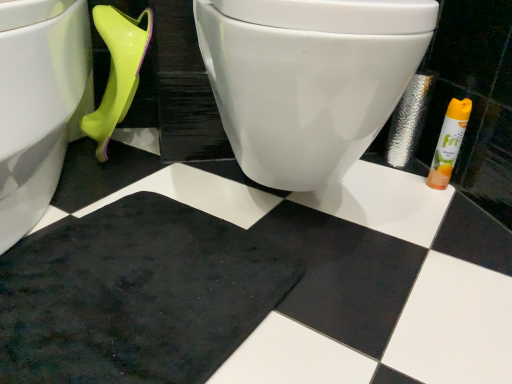
Describe the element at coordinates (308, 79) in the screenshot. I see `white glossy toilet at center, which is counted as the 1th toilet, starting from the right` at that location.

This screenshot has width=512, height=384. What are the coordinates of `white glossy toilet at lower left, which is the 1th toilet in left-to-right order` in the screenshot? It's located at 39,103.

What do you see at coordinates (39, 103) in the screenshot?
I see `white glossy toilet at lower left, the second toilet in the right-to-left sequence` at bounding box center [39, 103].

Locate an element on the screen. white glossy toilet at center, which is counted as the 1th toilet, starting from the right is located at coordinates (308, 79).

How different are the orientations of black rubber bath mat at lower left and white glossy toilet at center, which is counted as the 1th toilet, starting from the right, in degrees?

The facing directions of black rubber bath mat at lower left and white glossy toilet at center, which is counted as the 1th toilet, starting from the right, are 43.9 degrees apart.

Is black rubber bath mat at lower left smaller than white glossy toilet at center, which is counted as the 1th toilet, starting from the right?

Yes, black rubber bath mat at lower left is smaller than white glossy toilet at center, which is counted as the 1th toilet, starting from the right.

Are black rubber bath mat at lower left and white glossy toilet at center, which is counted as the 1th toilet, starting from the right, beside each other?

No, black rubber bath mat at lower left is not with white glossy toilet at center, which is counted as the 1th toilet, starting from the right.

From the image's perspective, would you say black rubber bath mat at lower left is shown under white glossy toilet at center, which is counted as the 1th toilet, starting from the right?

Yes.

Looking at the image, does orange matte air freshener at right seem bigger or smaller compared to black rubber bath mat at lower left?

Clearly, orange matte air freshener at right is smaller in size than black rubber bath mat at lower left.

Can you confirm if orange matte air freshener at right is positioned to the left of black rubber bath mat at lower left?

Incorrect, orange matte air freshener at right is not on the left side of black rubber bath mat at lower left.

Is black rubber bath mat at lower left at the back of orange matte air freshener at right?

That's not correct — orange matte air freshener at right is not looking away from black rubber bath mat at lower left.

From a real-world perspective, relative to black rubber bath mat at lower left, is orange matte air freshener at right vertically above or below?

orange matte air freshener at right is situated higher than black rubber bath mat at lower left in the real world.

Looking at this image, is orange matte air freshener at right not close to white glossy toilet at lower left, the second toilet in the right-to-left sequence?

Actually, orange matte air freshener at right and white glossy toilet at lower left, the second toilet in the right-to-left sequence, are a little close together.

From the image's perspective, who appears lower, orange matte air freshener at right or white glossy toilet at lower left, the second toilet in the right-to-left sequence?

orange matte air freshener at right is shown below in the image.

Is orange matte air freshener at right shorter than white glossy toilet at lower left, which is the 1th toilet in left-to-right order?

Yes.

How distant is orange matte air freshener at right from white glossy toilet at lower left, which is the 1th toilet in left-to-right order?

orange matte air freshener at right and white glossy toilet at lower left, which is the 1th toilet in left-to-right order, are 34.80 inches apart.

Could white glossy toilet at center, which is counted as the 1th toilet, starting from the right, be considered to be inside white glossy toilet at lower left, the second toilet in the right-to-left sequence?

That's incorrect, white glossy toilet at center, which is counted as the 1th toilet, starting from the right, is not inside white glossy toilet at lower left, the second toilet in the right-to-left sequence.

Locate an element on the screen. toilet on the right of white glossy toilet at lower left, which is the 1th toilet in left-to-right order is located at coordinates (308, 79).

Is white glossy toilet at lower left, which is the 1th toilet in left-to-right order, further to the viewer compared to white glossy toilet at center, which is counted as the 1th toilet, starting from the right?

No, white glossy toilet at lower left, which is the 1th toilet in left-to-right order, is in front of white glossy toilet at center, which is counted as the 1th toilet, starting from the right.

Can you tell me how much white glossy toilet at lower left, the second toilet in the right-to-left sequence, and white glossy toilet at center, which is counted as the 1th toilet, starting from the right, differ in facing direction?

white glossy toilet at lower left, the second toilet in the right-to-left sequence, and white glossy toilet at center, which is counted as the 1th toilet, starting from the right, are facing 0.459 degrees away from each other.

From the image's perspective, is black rubber bath mat at lower left below white glossy toilet at lower left, the second toilet in the right-to-left sequence?

Indeed, from the image's perspective, black rubber bath mat at lower left is shown beneath white glossy toilet at lower left, the second toilet in the right-to-left sequence.

Between black rubber bath mat at lower left and white glossy toilet at lower left, the second toilet in the right-to-left sequence, which one appears on the left side from the viewer's perspective?

white glossy toilet at lower left, the second toilet in the right-to-left sequence, is more to the left.

Is black rubber bath mat at lower left situated inside white glossy toilet at lower left, the second toilet in the right-to-left sequence, or outside?

The correct answer is: outside.

In the scene shown: Which point is more forward, (x=135, y=284) or (x=34, y=95)?

The point (x=135, y=284) is more forward.

Which of these two, white glossy toilet at center, which is counted as the 1th toilet, starting from the right, or orange matte air freshener at right, is bigger?

white glossy toilet at center, which is counted as the 1th toilet, starting from the right.

Is white glossy toilet at center, which is the 2th toilet from left to right, not within orange matte air freshener at right?

white glossy toilet at center, which is the 2th toilet from left to right, lies outside orange matte air freshener at right's area.

Where is `toiletry below the white glossy toilet at center, which is counted as the 1th toilet, starting from the right (from the image's perspective)`? This screenshot has width=512, height=384. toiletry below the white glossy toilet at center, which is counted as the 1th toilet, starting from the right (from the image's perspective) is located at coordinates (449, 143).

Does white glossy toilet at center, which is the 2th toilet from left to right, appear on the left side of orange matte air freshener at right?

Indeed, white glossy toilet at center, which is the 2th toilet from left to right, is positioned on the left side of orange matte air freshener at right.

Do you think white glossy toilet at center, which is counted as the 1th toilet, starting from the right, is within white glossy toilet at lower left, the second toilet in the right-to-left sequence, or outside of it?

white glossy toilet at center, which is counted as the 1th toilet, starting from the right, exists outside the volume of white glossy toilet at lower left, the second toilet in the right-to-left sequence.

Considering the sizes of objects white glossy toilet at center, which is the 2th toilet from left to right, and white glossy toilet at lower left, the second toilet in the right-to-left sequence, in the image provided, who is thinner, white glossy toilet at center, which is the 2th toilet from left to right, or white glossy toilet at lower left, the second toilet in the right-to-left sequence,?

With smaller width is white glossy toilet at center, which is the 2th toilet from left to right.

Does white glossy toilet at center, which is the 2th toilet from left to right, turn towards white glossy toilet at lower left, the second toilet in the right-to-left sequence?

No, white glossy toilet at center, which is the 2th toilet from left to right, is not aimed at white glossy toilet at lower left, the second toilet in the right-to-left sequence.

Looking at this image, which is nearer, (264, 87) or (46, 10)?

Clearly, point (264, 87) is closer to the camera than point (46, 10).

The image size is (512, 384). In order to click on the 2nd toilet positioned above the black rubber bath mat at lower left (from the image's perspective) in this screenshot , I will do pyautogui.click(x=308, y=79).

Locate an element on the screen. bath mat lying in front of the orange matte air freshener at right is located at coordinates (135, 295).

From the image, which object appears to be farther from black rubber bath mat at lower left, white glossy toilet at lower left, the second toilet in the right-to-left sequence, or orange matte air freshener at right?

orange matte air freshener at right is further to black rubber bath mat at lower left.

Looking at the image, which one is located closer to white glossy toilet at lower left, which is the 1th toilet in left-to-right order, orange matte air freshener at right or black rubber bath mat at lower left?

The object closer to white glossy toilet at lower left, which is the 1th toilet in left-to-right order, is black rubber bath mat at lower left.

From the picture: From the image, which object appears to be farther from white glossy toilet at center, which is the 2th toilet from left to right, black rubber bath mat at lower left or white glossy toilet at lower left, which is the 1th toilet in left-to-right order?

white glossy toilet at lower left, which is the 1th toilet in left-to-right order.

Considering their positions, is white glossy toilet at lower left, which is the 1th toilet in left-to-right order, positioned further to white glossy toilet at center, which is counted as the 1th toilet, starting from the right, than orange matte air freshener at right?

Among the two, orange matte air freshener at right is located further to white glossy toilet at center, which is counted as the 1th toilet, starting from the right.

Which object lies further to the anchor point white glossy toilet at lower left, the second toilet in the right-to-left sequence, white glossy toilet at center, which is the 2th toilet from left to right, or orange matte air freshener at right?

Based on the image, orange matte air freshener at right appears to be further to white glossy toilet at lower left, the second toilet in the right-to-left sequence.

When comparing their distances from black rubber bath mat at lower left, does white glossy toilet at center, which is the 2th toilet from left to right, or white glossy toilet at lower left, the second toilet in the right-to-left sequence, seem further?

white glossy toilet at center, which is the 2th toilet from left to right, is further to black rubber bath mat at lower left.

Consider the image. When comparing their distances from black rubber bath mat at lower left, does orange matte air freshener at right or white glossy toilet at center, which is counted as the 1th toilet, starting from the right, seem closer?

white glossy toilet at center, which is counted as the 1th toilet, starting from the right, is positioned closer to the anchor black rubber bath mat at lower left.

Considering their positions, is black rubber bath mat at lower left positioned closer to orange matte air freshener at right than white glossy toilet at center, which is counted as the 1th toilet, starting from the right?

Based on the image, white glossy toilet at center, which is counted as the 1th toilet, starting from the right, appears to be nearer to orange matte air freshener at right.

Find the location of `bath mat between white glossy toilet at lower left, which is the 1th toilet in left-to-right order, and white glossy toilet at center, which is the 2th toilet from left to right`. bath mat between white glossy toilet at lower left, which is the 1th toilet in left-to-right order, and white glossy toilet at center, which is the 2th toilet from left to right is located at coordinates (135, 295).

This screenshot has height=384, width=512. What are the coordinates of `toilet between black rubber bath mat at lower left and orange matte air freshener at right from left to right` in the screenshot? It's located at (308, 79).

The height and width of the screenshot is (384, 512). I want to click on bath mat situated between white glossy toilet at lower left, the second toilet in the right-to-left sequence, and orange matte air freshener at right from left to right, so click(x=135, y=295).

Identify the location of toilet between white glossy toilet at lower left, the second toilet in the right-to-left sequence, and orange matte air freshener at right, in the horizontal direction. The height and width of the screenshot is (384, 512). (308, 79).